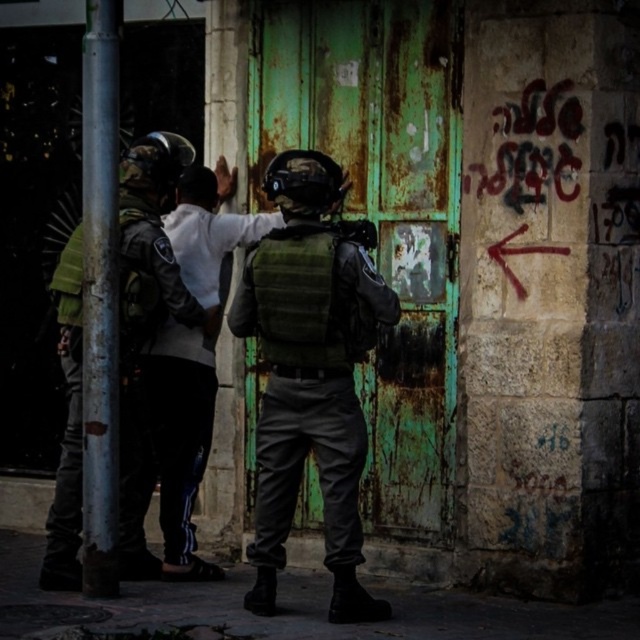
In the scene shown: You are a security officer observing the scene. You notice the green matte vest at center and the silver metallic pole at left. Which object is positioned lower in the image?

The green matte vest at center is positioned below the silver metallic pole at left, so it is lower in the image.

You are a security officer assessing the scene. You notice the green matte vest at center and the silver metallic pole at left. Which object takes up more space in the image?

The green matte vest at center is bigger than the silver metallic pole at left, so it takes up more space in the image.

In the scene shown: You are observing a scene with two people in tactical gear and a civilian. You notice a green matte vest at center and a white cotton shirt at left. Which object is located to the right of the other?

The green matte vest at center is positioned on the right side of white cotton shirt at left.